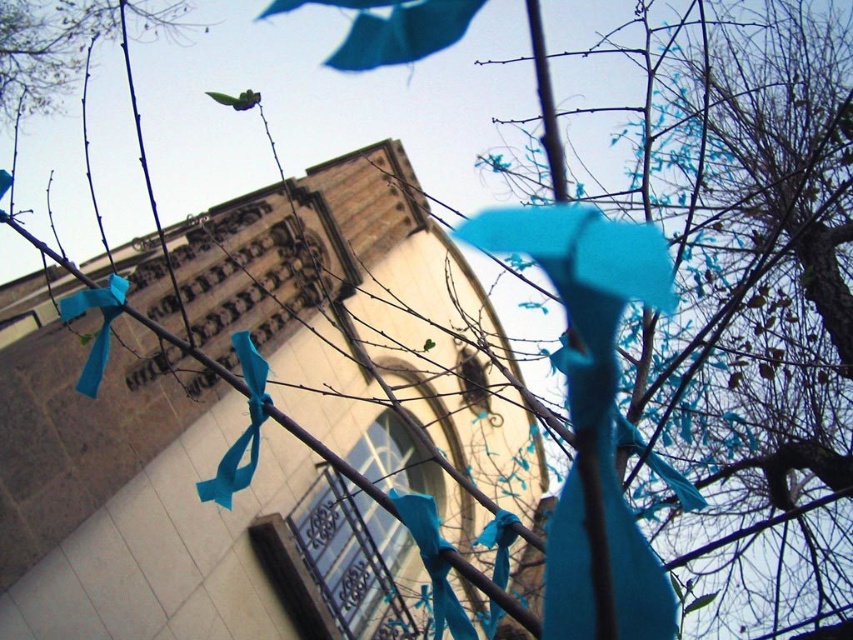
You are an artist planning to paint the tree with ribbons. You need to know which ribbon has a narrower width between the teal fabric ribbon at center and the matte blue ribbon at left. Which one should you depict as narrower?

The teal fabric ribbon at center has a lesser width compared to the matte blue ribbon at left, so you should depict the teal fabric ribbon at center as narrower.

You are a maintenance worker tasked with checking the distance between two specific ribbons on the tree. You need to ensure that the distance between the matte blue ribbon at center and the matte blue ribbon at left is at least 5 meters. Based on the scene, can you confirm if this requirement is met?

The distance between the matte blue ribbon at center and the matte blue ribbon at left is 5.41 meters, which exceeds the required 5 meters. Therefore, the requirement is met.